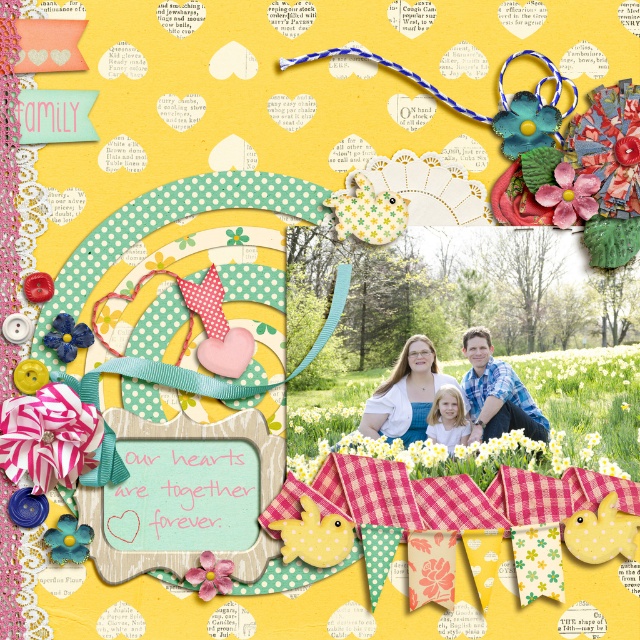
Does pink fabric flower at lower left appear on the left side of blue plaid shirt at center?

Correct, you'll find pink fabric flower at lower left to the left of blue plaid shirt at center.

Is point (45, 467) farther from viewer compared to point (470, 348)?

No, it is in front of (470, 348).

The width and height of the screenshot is (640, 640). I want to click on pink fabric flower at lower left, so click(49, 436).

Which is more to the right, white paper flower at center or matte white sweater at center?

white paper flower at center is more to the right.

How much distance is there between white paper flower at center and matte white sweater at center?

white paper flower at center and matte white sweater at center are 3.18 inches apart.

Between point (561, 464) and point (401, 435), which one is positioned behind?

The point (401, 435) is behind.

At what (x,y) coordinates should I click in order to perform the action: click on white paper flower at center. Please return your answer as a coordinate pair (x, y). The width and height of the screenshot is (640, 640). Looking at the image, I should click on (467, 456).

Is matte white sweater at center to the left of pink glossy flower at center from the viewer's perspective?

In fact, matte white sweater at center is to the right of pink glossy flower at center.

Is the position of matte white sweater at center more distant than that of pink glossy flower at center?

That is True.

What do you see at coordinates (404, 394) in the screenshot?
I see `matte white sweater at center` at bounding box center [404, 394].

The height and width of the screenshot is (640, 640). In order to click on matte white sweater at center in this screenshot , I will do `click(404, 394)`.